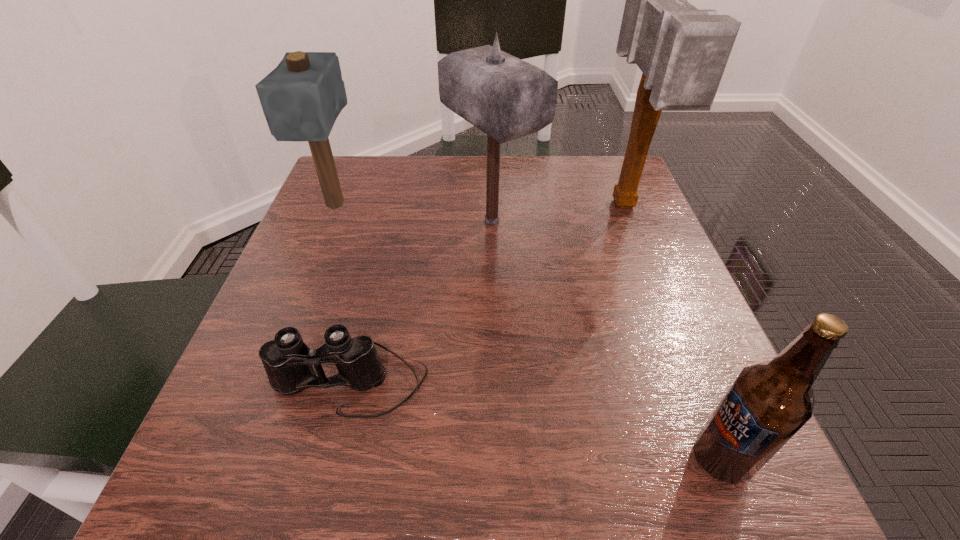
In order to click on vacant area situated 0.280m on the label of the nearest object in this screenshot , I will do `click(484, 458)`.

Find the location of a particular element. vacant space located 0.140m on the label of the nearest object is located at coordinates (589, 458).

Where is `free region located 0.210m on the label of the nearest object`? free region located 0.210m on the label of the nearest object is located at coordinates (537, 458).

Where is `free space located 0.360m on the back of the shortest object`? This screenshot has width=960, height=540. free space located 0.360m on the back of the shortest object is located at coordinates (391, 217).

Locate an element on the screen. This screenshot has height=540, width=960. object situated at the near edge is located at coordinates pos(767,404).

Locate an element on the screen. mallet located at the left edge is located at coordinates (301, 98).

The image size is (960, 540). In order to click on binoculars at the left edge in this screenshot , I will do `click(287, 360)`.

Find the location of `mallet situated at the right edge`. mallet situated at the right edge is located at coordinates (682, 51).

Find the location of `beer bottle present at the right edge`. beer bottle present at the right edge is located at coordinates (767, 404).

Image resolution: width=960 pixels, height=540 pixels. I want to click on object positioned at the far left corner, so pyautogui.click(x=301, y=98).